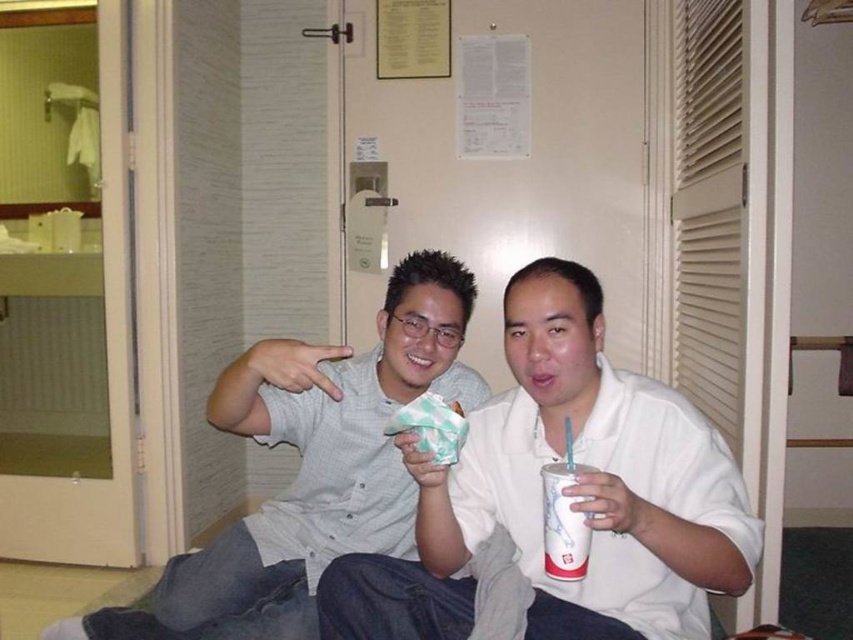
You are a photographer trying to capture a candid shot of the white matte shirt at center and the matte paper ice cream cone at center. Since you want to ensure both are fully visible in the frame, which object should you focus on first to account for their size difference?

The white matte shirt at center is much taller than the matte paper ice cream cone at center, so you should focus on the white matte shirt at center first to ensure its full height is captured before adjusting the frame for the smaller cone.

You are a delivery person entering the room and need to hand over a matte paper ice cream cone at center to the person wearing the matte gray shirt at center. Based on their positions, can you directly hand the ice cream cone to the person without moving any objects in the scene?

The matte paper ice cream cone at center is behind the matte gray shirt at center, so you cannot directly hand it over without moving the shirt or adjusting your position since the cone is obstructed by the shirt.

From the picture: You are standing in the room and see the point at coordinates [566,493]. What object is located at that point?

The point at coordinates [566,493] corresponds to the white matte shirt at center.